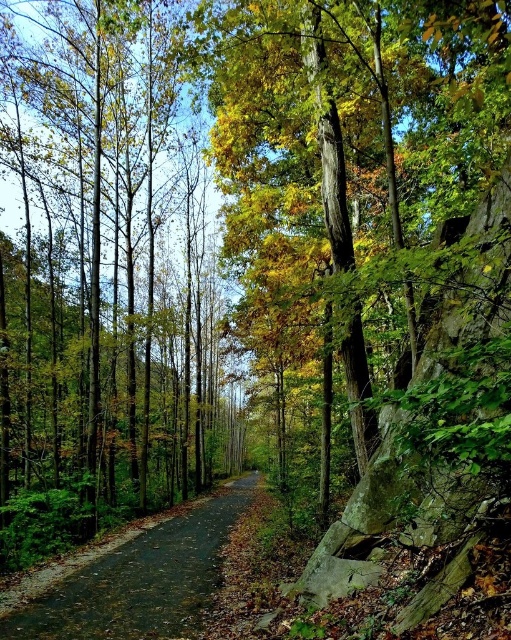
Can you confirm if brown smooth tree at center is wider than dark asphalt road at center?

Yes.

Does brown smooth tree at center have a smaller size compared to dark asphalt road at center?

No, brown smooth tree at center is not smaller than dark asphalt road at center.

Which is behind, point (34, 193) or point (96, 612)?

The point (34, 193) is more distant.

You are a GUI agent. You are given a task and a screenshot of the screen. Output one action in this format:
    pyautogui.click(x=<x>, y=<y>)
    Task: Click on the brown smooth tree at center
    The width and height of the screenshot is (511, 640).
    Given the screenshot: What is the action you would take?
    pyautogui.click(x=104, y=275)